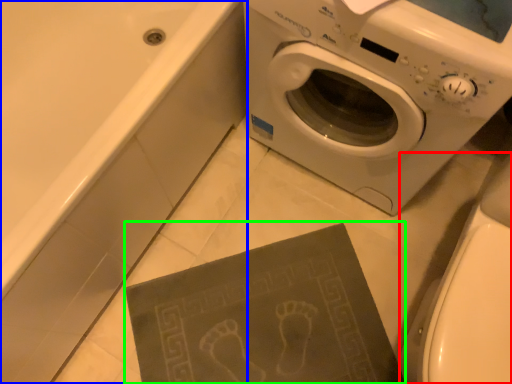
Question: Which is nearer to the toilet bowl (highlighted by a red box)? bath (highlighted by a blue box) or paperback book (highlighted by a green box).

Choices:
 (A) bath
 (B) paperback book

Answer: (B)